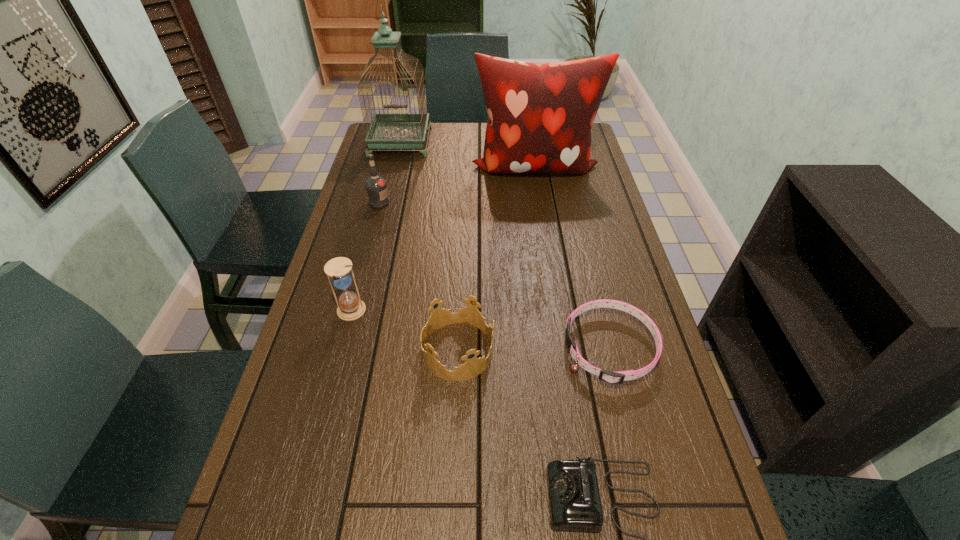
You are a GUI agent. You are given a task and a screenshot of the screen. Output one action in this format:
    pyautogui.click(x=<x>, y=<y>)
    Task: Click on the tallest object
    This screenshot has height=540, width=960.
    Given the screenshot: What is the action you would take?
    pyautogui.click(x=387, y=130)

Find the location of a particular element. cushion is located at coordinates (540, 116).

Locate an element on the screen. Image resolution: width=960 pixels, height=540 pixels. vodka is located at coordinates (376, 186).

Locate an element on the screen. The height and width of the screenshot is (540, 960). hourglass is located at coordinates (350, 307).

At what (x,y) coordinates should I click in order to perform the action: click on tiara. Please return your answer as a coordinate pair (x, y). The image size is (960, 540). Looking at the image, I should click on (470, 315).

Find the location of a particular element. dog collar is located at coordinates (617, 377).

Find the location of a particular element. Image resolution: width=960 pixels, height=540 pixels. free space located at the door of the tallest object is located at coordinates (385, 204).

Where is `vacant space located 0.080m on the front-facing side of the cushion`? vacant space located 0.080m on the front-facing side of the cushion is located at coordinates (540, 201).

I want to click on blank area located on the front label of the fifth nearest object, so click(491, 202).

Identify the location of vacant space situated 0.200m on the back of the hourglass. (368, 248).